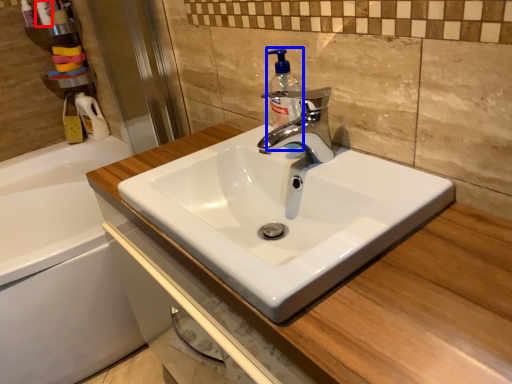
Question: Among these objects, which one is farthest to the camera, toiletry (highlighted by a red box) or soap dispenser (highlighted by a blue box)?

Choices:
 (A) toiletry
 (B) soap dispenser

Answer: (A)